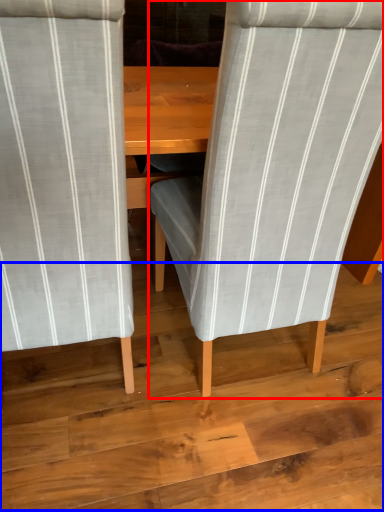
Question: Which object appears closest to the camera in this image, chair (highlighted by a red box) or plywood (highlighted by a blue box)?

Choices:
 (A) chair
 (B) plywood

Answer: (A)